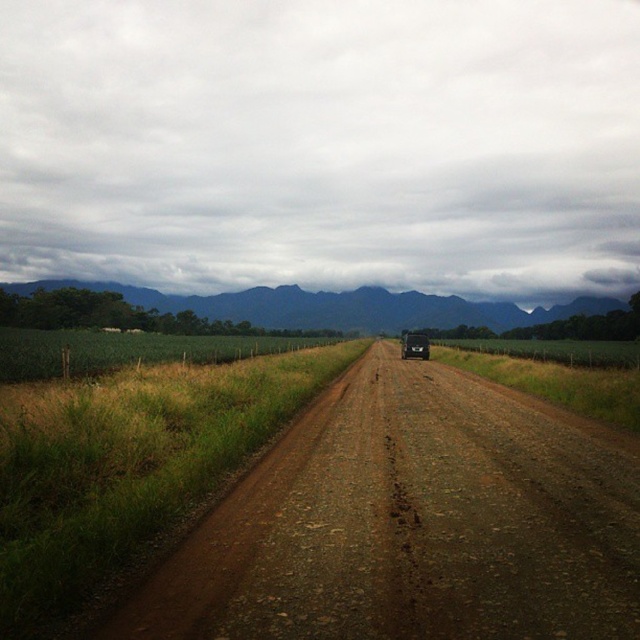
Question: Is brown gravel road at center bigger than brown dirt field at left?

Choices:
 (A) no
 (B) yes

Answer: (A)

Question: In this image, where is brown dirt field at left located relative to black matte bus at center?

Choices:
 (A) above
 (B) below

Answer: (A)

Question: Among these objects, which one is farthest from the camera?

Choices:
 (A) black matte bus at center
 (B) brown dirt field at left

Answer: (A)

Question: Which point appears farthest from the camera in this image?

Choices:
 (A) (161, 440)
 (B) (305, 312)
 (C) (424, 356)

Answer: (B)

Question: Does brown gravel road at center have a smaller size compared to black matte bus at center?

Choices:
 (A) no
 (B) yes

Answer: (B)

Question: Estimate the real-world distances between objects in this image. Which object is farther from the brown dirt field at left?

Choices:
 (A) brown gravel road at center
 (B) black matte bus at center
 (C) green grassy field at upper center

Answer: (C)